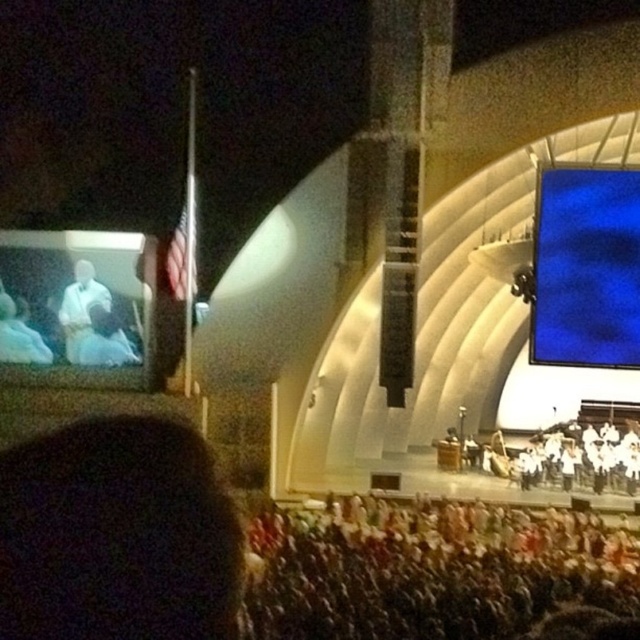
Who is positioned more to the right, dark hair at lower left or matte white robe at upper left?

dark hair at lower left

Is dark hair at lower left bigger than matte white robe at upper left?

Yes.

Does point (3, 618) come farther from viewer compared to point (28, 362)?

That is False.

Locate an element on the screen. dark hair at lower left is located at coordinates (116, 534).

The width and height of the screenshot is (640, 640). I want to click on white fabric crowd at lower center, so click(x=429, y=570).

Is white fabric crowd at lower center above white cloth at left?

No, white fabric crowd at lower center is not above white cloth at left.

Between point (365, 608) and point (90, 358), which one is positioned in front?

Positioned in front is point (365, 608).

At what (x,y) coordinates should I click in order to perform the action: click on white fabric crowd at lower center. Please return your answer as a coordinate pair (x, y). This screenshot has height=640, width=640. Looking at the image, I should click on (429, 570).

Can you confirm if dark hair at lower left is positioned below blue fabric screen at upper right?

Yes, dark hair at lower left is below blue fabric screen at upper right.

Is point (182, 573) farther from viewer compared to point (586, 241)?

No.

Which is behind, point (118, 600) or point (541, 225)?

Point (541, 225)

Locate an element on the screen. This screenshot has width=640, height=640. dark hair at lower left is located at coordinates (116, 534).